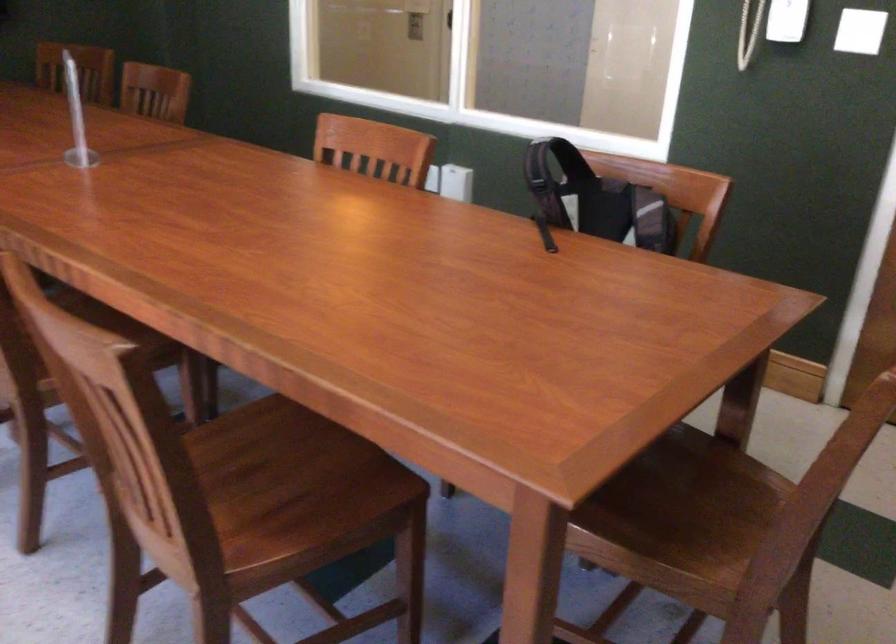
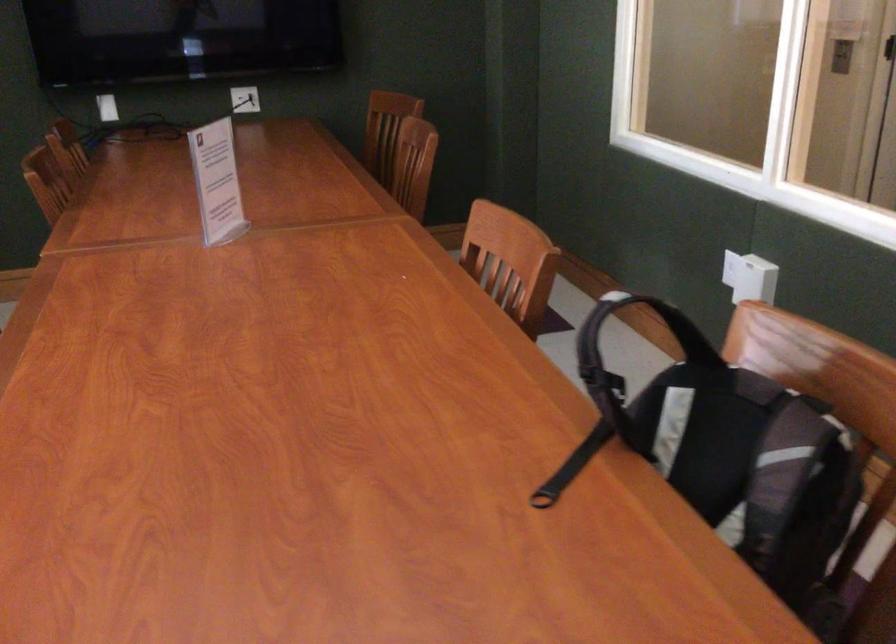
The point at (373, 154) is marked in the first image. Where is the corresponding point in the second image?

(510, 261)